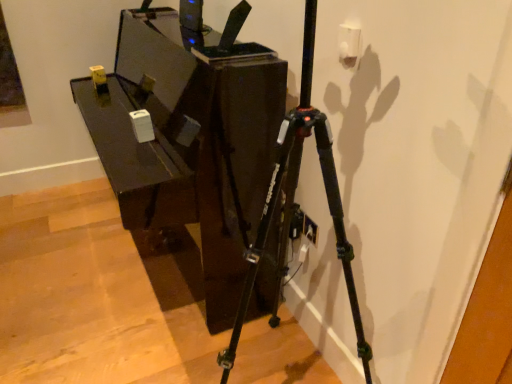
Question: Should I look upward or downward to see glossy dark wood table at center?

Choices:
 (A) down
 (B) up

Answer: (B)